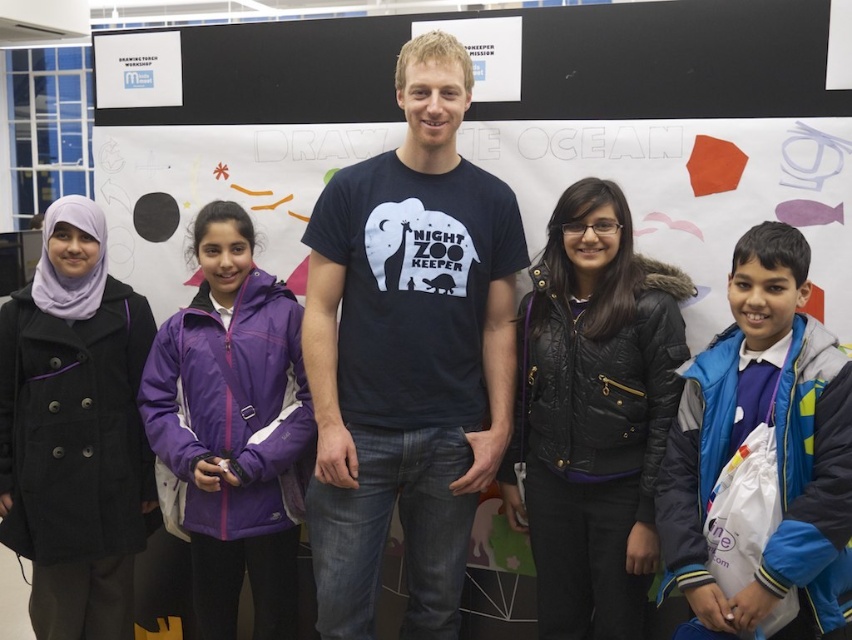
Question: Which object is the closest to the dark blue t-shirt at center?

Choices:
 (A) blue fleece jacket at lower right
 (B) purple fleece jacket at center

Answer: (B)

Question: Does dark blue t-shirt at center lie behind black quilted jacket at center?

Choices:
 (A) yes
 (B) no

Answer: (A)

Question: Is black quilted jacket at center positioned in front of black wool coat at left?

Choices:
 (A) yes
 (B) no

Answer: (A)

Question: Among these points, which one is farthest from the camera?

Choices:
 (A) (810, 636)
 (B) (271, 458)
 (C) (61, 444)
 (D) (554, 513)

Answer: (C)

Question: Can you confirm if black quilted jacket at center is positioned to the right of black wool coat at left?

Choices:
 (A) yes
 (B) no

Answer: (A)

Question: Which point is farther from the camera taking this photo?

Choices:
 (A) (262, 362)
 (B) (441, 557)
 (C) (91, 636)

Answer: (C)